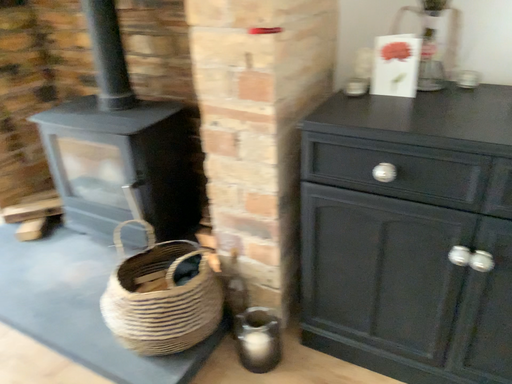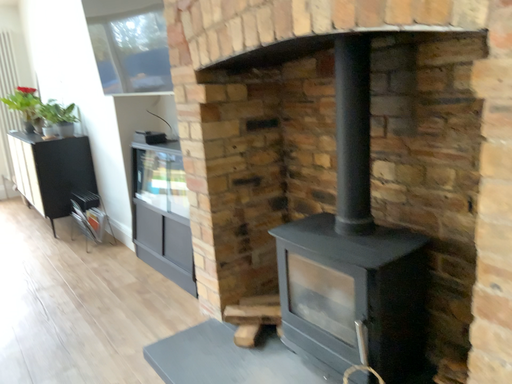
Question: How did the camera likely rotate when shooting the video?

Choices:
 (A) rotated left
 (B) rotated right

Answer: (A)